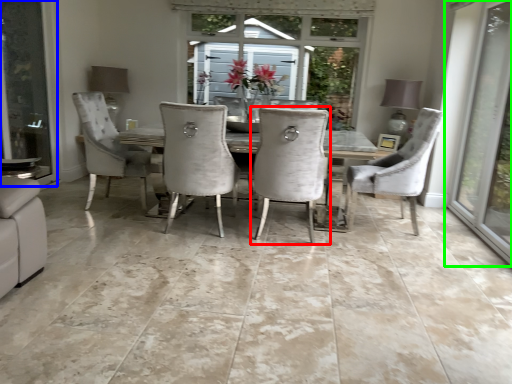
Question: Based on their relative distances, which object is farther from chair (highlighted by a red box)? Choose from screen door (highlighted by a blue box) and window (highlighted by a green box).

Choices:
 (A) screen door
 (B) window

Answer: (A)